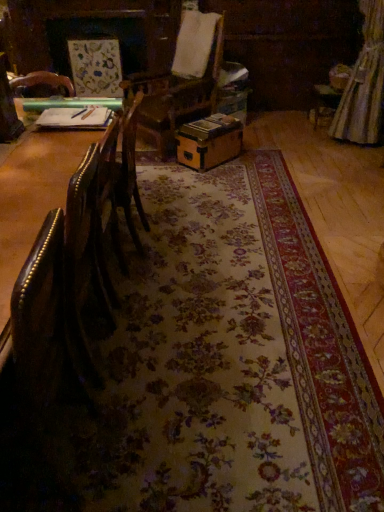
Question: Is leather couch at left in front of silky beige curtain at upper right?

Choices:
 (A) no
 (B) yes

Answer: (B)

Question: Can you confirm if leather couch at left is bigger than silky beige curtain at upper right?

Choices:
 (A) no
 (B) yes

Answer: (B)

Question: Could you tell me if leather couch at left is turned towards silky beige curtain at upper right?

Choices:
 (A) yes
 (B) no

Answer: (B)

Question: Are leather couch at left and silky beige curtain at upper right making contact?

Choices:
 (A) yes
 (B) no

Answer: (B)

Question: From a real-world perspective, is leather couch at left physically below silky beige curtain at upper right?

Choices:
 (A) no
 (B) yes

Answer: (A)

Question: Is point (39, 159) positioned closer to the camera than point (380, 51)?

Choices:
 (A) closer
 (B) farther

Answer: (A)

Question: Would you say leather couch at left is to the left or to the right of silky beige curtain at upper right in the picture?

Choices:
 (A) right
 (B) left

Answer: (B)

Question: Is leather couch at left bigger or smaller than silky beige curtain at upper right?

Choices:
 (A) small
 (B) big

Answer: (B)

Question: From a real-world perspective, is leather couch at left positioned above or below silky beige curtain at upper right?

Choices:
 (A) below
 (B) above

Answer: (B)

Question: Choose the correct answer: Is wooden box at center inside silky beige curtain at upper right or outside it?

Choices:
 (A) outside
 (B) inside

Answer: (A)

Question: Considering the positions of wooden box at center and silky beige curtain at upper right in the image, is wooden box at center wider or thinner than silky beige curtain at upper right?

Choices:
 (A) thin
 (B) wide

Answer: (B)

Question: From the image's perspective, is wooden box at center positioned above or below silky beige curtain at upper right?

Choices:
 (A) below
 (B) above

Answer: (A)

Question: Is wooden box at center in front of or behind silky beige curtain at upper right in the image?

Choices:
 (A) front
 (B) behind

Answer: (A)

Question: Do you think silky beige curtain at upper right is within leather couch at left, or outside of it?

Choices:
 (A) inside
 (B) outside

Answer: (B)

Question: Visually, is silky beige curtain at upper right positioned to the left or to the right of leather couch at left?

Choices:
 (A) right
 (B) left

Answer: (A)